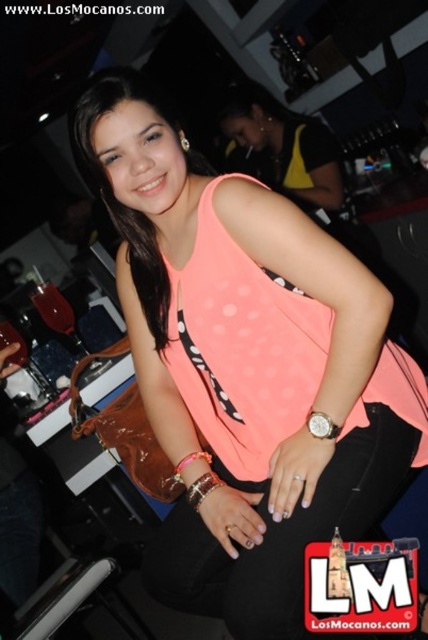
You are a photographer adjusting the camera focus. The subject is the woman in the image. You need to focus on her silver metallic bracelet at wrist. According to the coordinates provided, where should you adjust the focus to? Please provide the coordinates in the format of a point like point (202, 486).

The point to focus on is point (202, 486), which marks the location of the silver metallic bracelet at wrist.

You are a fashion designer observing the image. You need to determine which item is taller between the neon orange fabric top at center and the silver metallic bracelet at wrist. Which one is taller?

The neon orange fabric top at center has a greater height compared to the silver metallic bracelet at wrist, so the neon orange fabric top at center is taller.